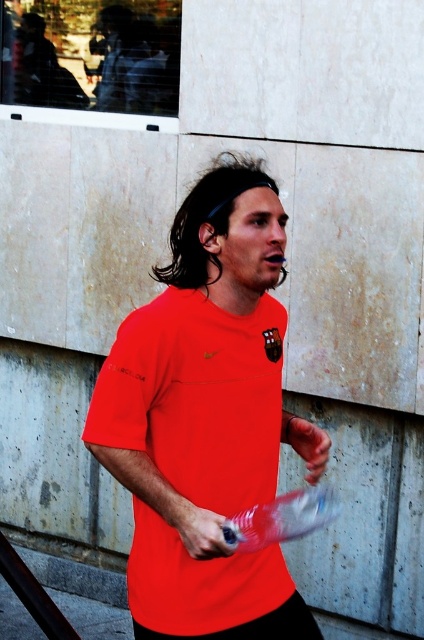
Is transparent plastic bottle at center closer to camera compared to matte plastic bottle at center?

No, transparent plastic bottle at center is behind matte plastic bottle at center.

Between point (296, 524) and point (198, 538), which one is positioned behind?

The point (296, 524) is behind.

Find the location of a particular element. This screenshot has width=424, height=640. transparent plastic bottle at center is located at coordinates [x=281, y=518].

Identify the location of matte plastic bottle at center. The image size is (424, 640). [x=198, y=529].

Does matte plastic bottle at center come behind smooth skin hand at center?

No, matte plastic bottle at center is in front of smooth skin hand at center.

Image resolution: width=424 pixels, height=640 pixels. What do you see at coordinates (198, 529) in the screenshot?
I see `matte plastic bottle at center` at bounding box center [198, 529].

Locate an element on the screen. The image size is (424, 640). matte plastic bottle at center is located at coordinates (198, 529).

Between point (183, 426) and point (292, 532), which one is positioned in front?

Positioned in front is point (183, 426).

What are the coordinates of `matte red shirt at center` in the screenshot? It's located at (203, 413).